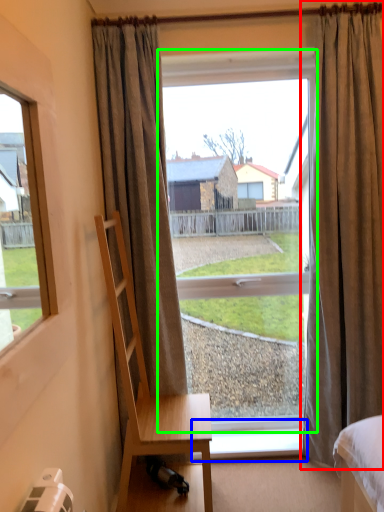
Question: Considering the real-world distances, which object is farthest from curtain (highlighted by a red box)? window sill (highlighted by a blue box) or window (highlighted by a green box)?

Choices:
 (A) window sill
 (B) window

Answer: (A)